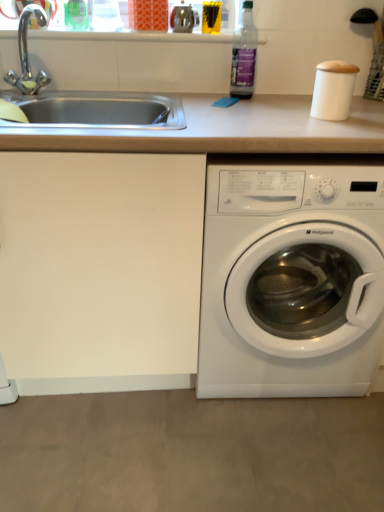
Question: From a real-world perspective, is chrome metallic faucet at upper left on white plastic washing machine at lower right?

Choices:
 (A) yes
 (B) no

Answer: (A)

Question: Is chrome metallic faucet at upper left at the left side of white plastic washing machine at lower right?

Choices:
 (A) yes
 (B) no

Answer: (A)

Question: Can you confirm if chrome metallic faucet at upper left is bigger than white plastic washing machine at lower right?

Choices:
 (A) yes
 (B) no

Answer: (B)

Question: Would you say chrome metallic faucet at upper left is a long distance from white plastic washing machine at lower right?

Choices:
 (A) no
 (B) yes

Answer: (B)

Question: Could you tell me if chrome metallic faucet at upper left is facing white plastic washing machine at lower right?

Choices:
 (A) no
 (B) yes

Answer: (A)

Question: Is chrome metallic faucet at upper left looking in the opposite direction of white plastic washing machine at lower right?

Choices:
 (A) yes
 (B) no

Answer: (B)

Question: Does transparent plastic bottle at upper right appear on the right side of chrome metallic faucet at upper left?

Choices:
 (A) no
 (B) yes

Answer: (B)

Question: Can you confirm if transparent plastic bottle at upper right is shorter than chrome metallic faucet at upper left?

Choices:
 (A) yes
 (B) no

Answer: (B)

Question: Considering the relative sizes of transparent plastic bottle at upper right and chrome metallic faucet at upper left in the image provided, is transparent plastic bottle at upper right taller than chrome metallic faucet at upper left?

Choices:
 (A) yes
 (B) no

Answer: (A)

Question: Can you confirm if transparent plastic bottle at upper right is wider than chrome metallic faucet at upper left?

Choices:
 (A) yes
 (B) no

Answer: (B)

Question: From a real-world perspective, is transparent plastic bottle at upper right located higher than chrome metallic faucet at upper left?

Choices:
 (A) yes
 (B) no

Answer: (A)

Question: Is transparent plastic bottle at upper right further to camera compared to chrome metallic faucet at upper left?

Choices:
 (A) yes
 (B) no

Answer: (A)

Question: From the image's perspective, is white matte counter top at center on chrome metallic faucet at upper left?

Choices:
 (A) yes
 (B) no

Answer: (B)